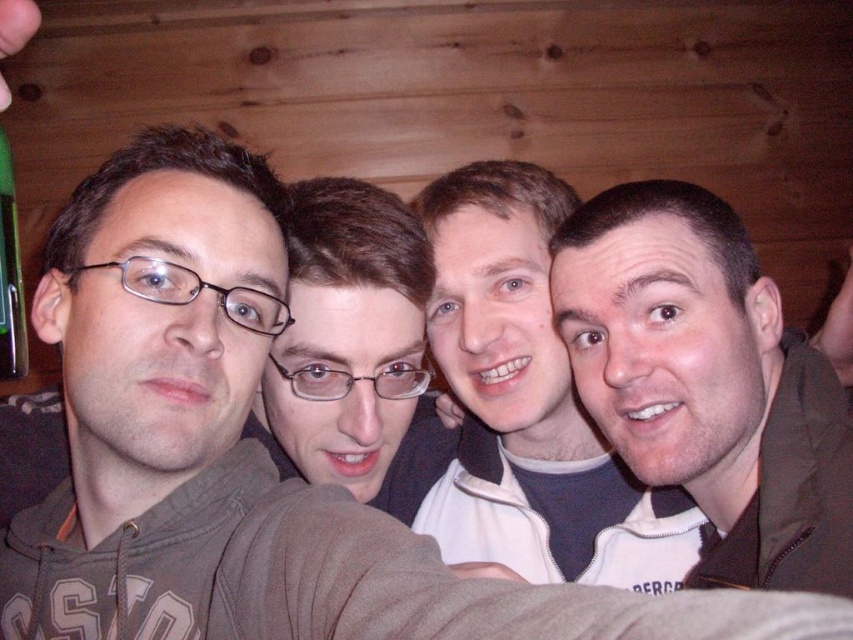
You are trying to locate the white fleece jacket at center in the image. According to the coordinates provided, where exactly would you find it?

The white fleece jacket at center is located at point coordinates (529, 403).

You are taking a photo of the group and notice the white fleece jacket at center and the green plastic bottle at left. Which object is closer to the camera?

The white fleece jacket at center is closer to the camera than the green plastic bottle at left because it is further to the viewer.

You are organizing a small event and need to place a 15 cm wide decorative item on the table. You have a brown matte jacket at right and a green plastic bottle at left available. Which object can accommodate the decorative item without it falling off?

The brown matte jacket at right has a larger size compared to the green plastic bottle at left, so it can accommodate the 15 cm wide decorative item without it falling off.